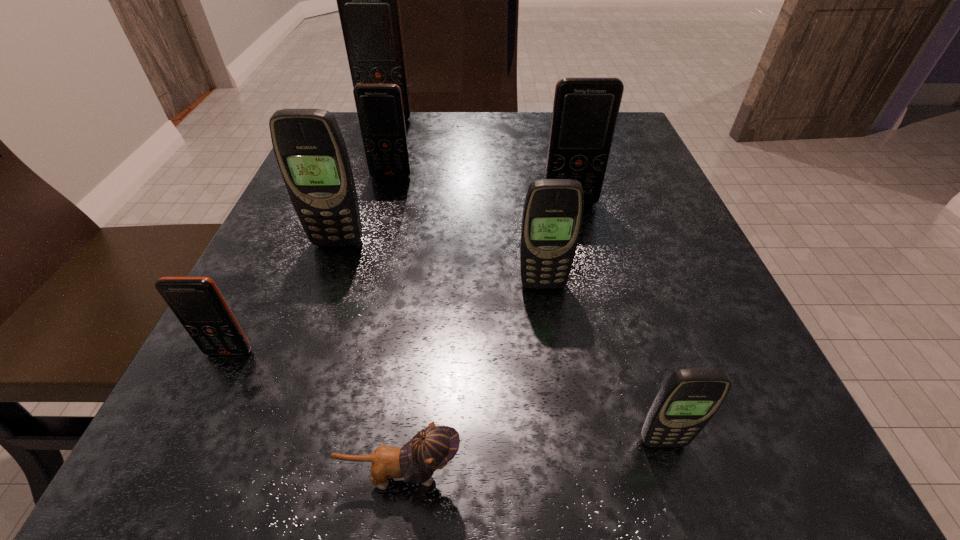
Identify the location of free space that satisfies the following two spatial constraints: 1. on the screen of the second nearest gray cellular telephone; 2. on the front-facing side of the nearest object. This screenshot has height=540, width=960. (569, 475).